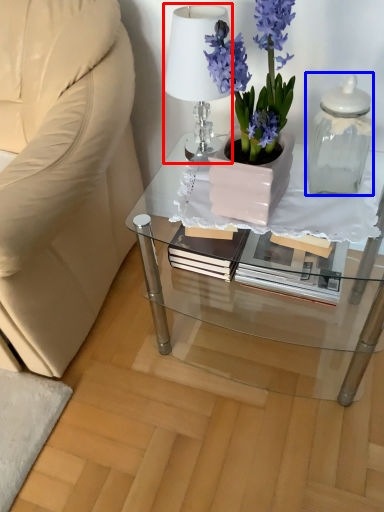
Question: Which point is further to the camera, lamp (highlighted by a red box) or bottle (highlighted by a blue box)?

Choices:
 (A) lamp
 (B) bottle

Answer: (A)